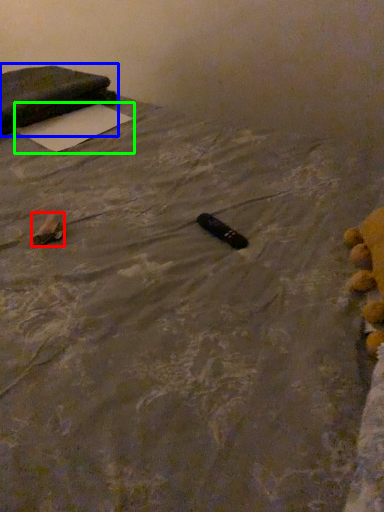
Question: Which object is positioned closest to waste (highlighted by a red box)? Select from furniture (highlighted by a blue box) and yoga mat (highlighted by a green box).

Choices:
 (A) furniture
 (B) yoga mat

Answer: (B)